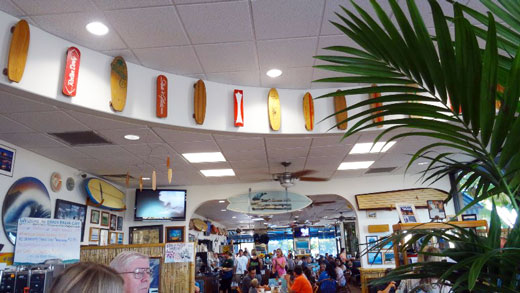
This screenshot has width=520, height=293. In order to click on archway in this screenshot , I will do `click(336, 201)`.